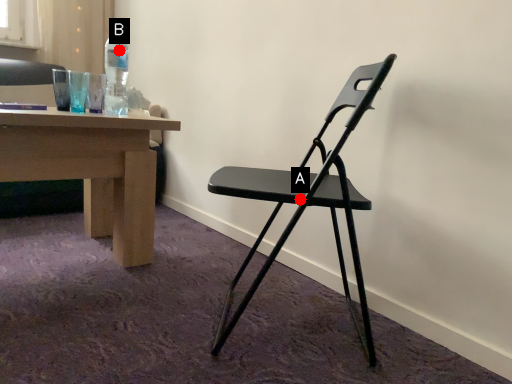
Question: Two points are circled on the image, labeled by A and B beside each circle. Which point appears farthest from the camera in this image?

Choices:
 (A) A is further
 (B) B is further

Answer: (B)